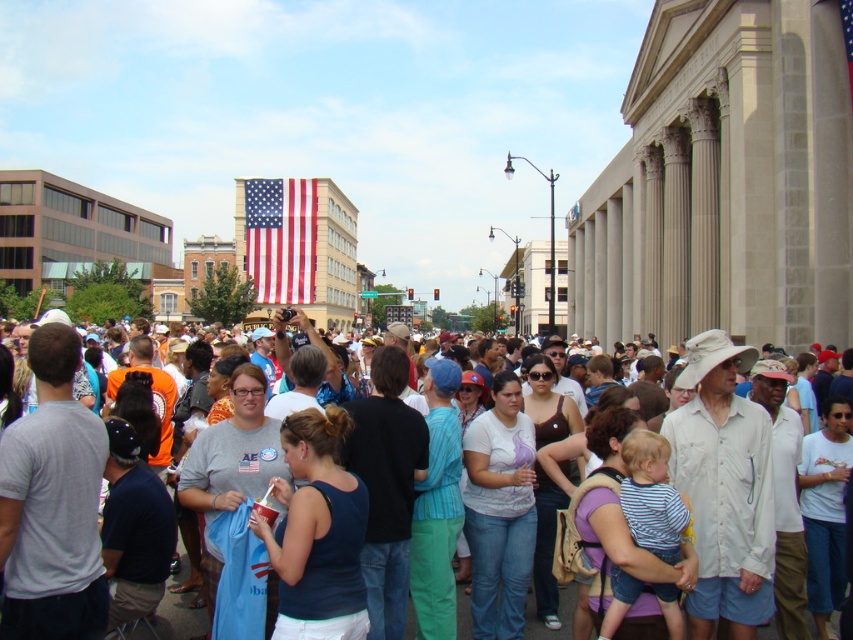
You are a photographer at the event and want to capture a photo that includes both the white cotton shirt at center and the american flag at upper center. However, your camera has a limited zoom range. Based on their heights, which object should you focus on to ensure both are in frame without cropping?

The white cotton shirt at center is taller than the american flag at upper center, so focusing on the white cotton shirt at center will ensure both are visible in the frame without cropping.